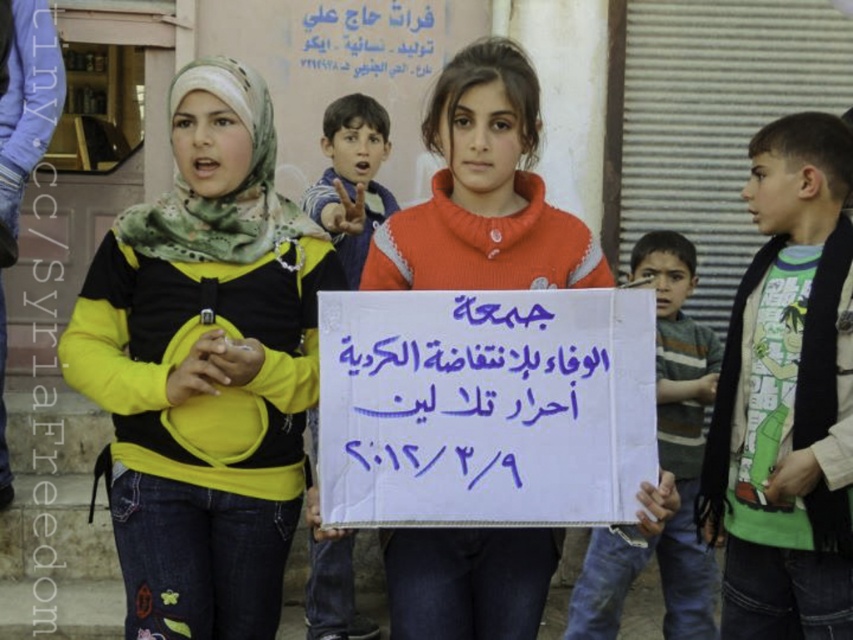
Question: Is green printed t-shirt at center further to the viewer compared to orange cotton shirt at center?

Choices:
 (A) yes
 (B) no

Answer: (B)

Question: Which object appears closest to the camera in this image?

Choices:
 (A) yellow-green jersey at center
 (B) green printed t-shirt at center
 (C) orange cotton shirt at center
 (D) white cardboard sign at center

Answer: (A)

Question: Which object appears farthest from the camera in this image?

Choices:
 (A) green printed t-shirt at center
 (B) white cardboard sign at center
 (C) yellow-green jersey at center
 (D) striped cotton shirt at center

Answer: (D)

Question: Is yellow-green jersey at center closer to the viewer compared to green printed t-shirt at center?

Choices:
 (A) no
 (B) yes

Answer: (B)

Question: Considering the relative positions of green printed t-shirt at center and striped cotton shirt at center in the image provided, where is green printed t-shirt at center located with respect to striped cotton shirt at center?

Choices:
 (A) below
 (B) above

Answer: (B)

Question: Which object is the farthest from the white cardboard sign at center?

Choices:
 (A) orange cotton shirt at center
 (B) yellow-green jersey at center
 (C) striped cotton shirt at center
 (D) green printed t-shirt at center

Answer: (D)